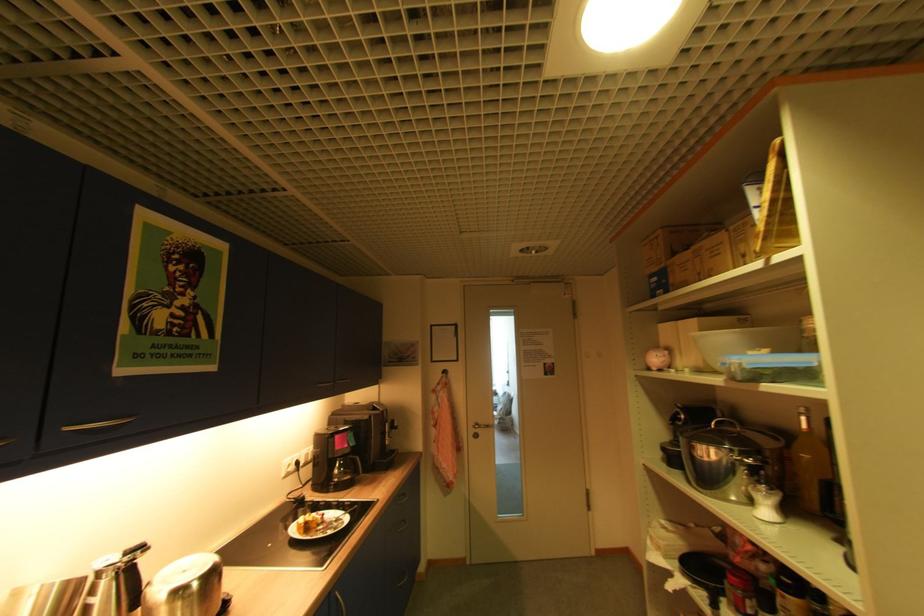
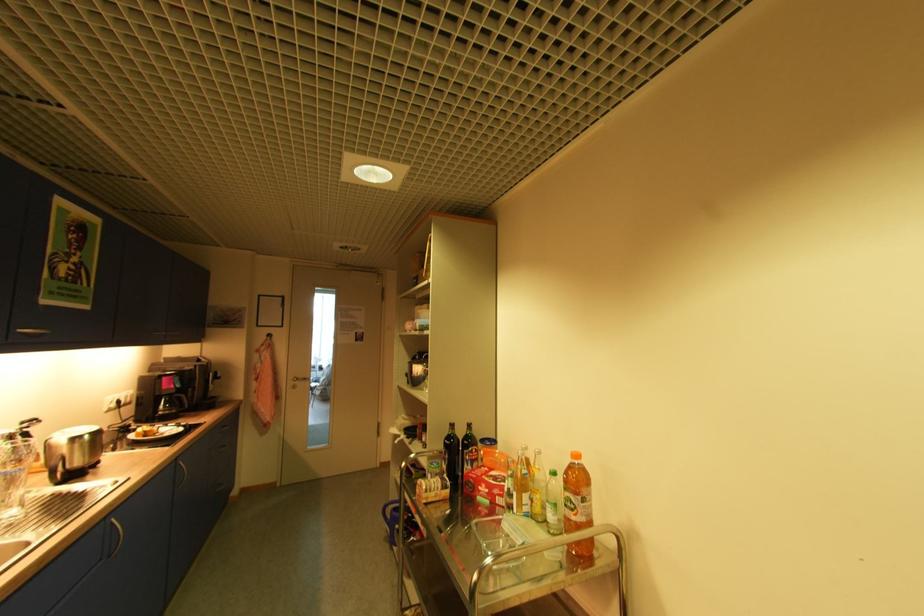
Question: In a continuous first-person perspective shot, in which direction is the camera moving?

Choices:
 (A) Left
 (B) Right
 (C) Forward
 (D) Backward

Answer: (D)